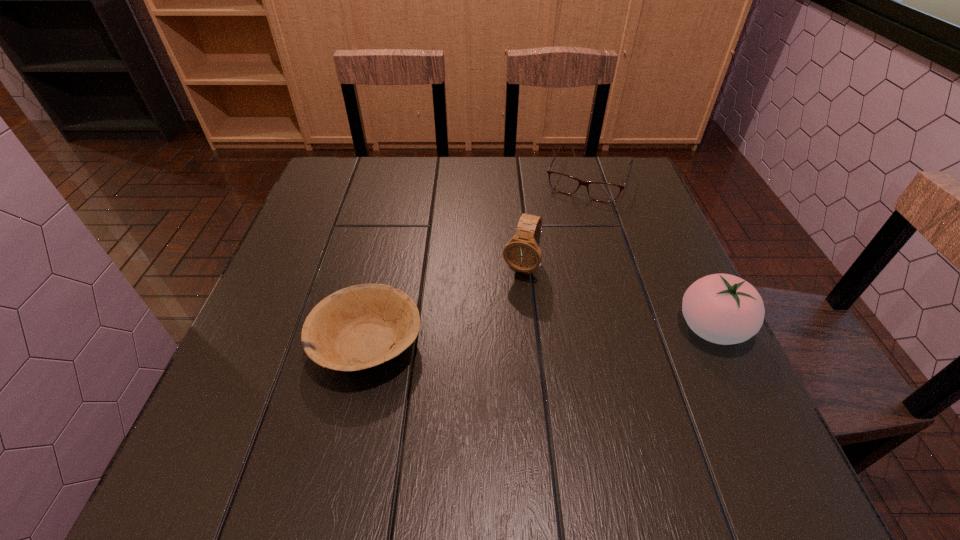
Where is `the leftmost object`? Image resolution: width=960 pixels, height=540 pixels. the leftmost object is located at coordinates (361, 326).

This screenshot has height=540, width=960. Identify the location of tomato. (724, 309).

Image resolution: width=960 pixels, height=540 pixels. I want to click on watch, so click(x=522, y=253).

What are the coordinates of `the third object from right to left` in the screenshot? It's located at (522, 253).

Image resolution: width=960 pixels, height=540 pixels. What are the coordinates of `the farthest object` in the screenshot? It's located at (599, 191).

Where is `free space located on the back of the leftmost object`? The image size is (960, 540). free space located on the back of the leftmost object is located at coordinates (385, 264).

This screenshot has height=540, width=960. Find the location of `free space located 0.370m on the left of the tomato`. free space located 0.370m on the left of the tomato is located at coordinates (486, 328).

Locate an element on the screen. vacant area situated 0.320m on the face of the third nearest object is located at coordinates (462, 415).

Where is `free space located 0.110m on the face of the third nearest object`? The width and height of the screenshot is (960, 540). free space located 0.110m on the face of the third nearest object is located at coordinates (500, 322).

Identify the location of free space located on the face of the third nearest object. (468, 400).